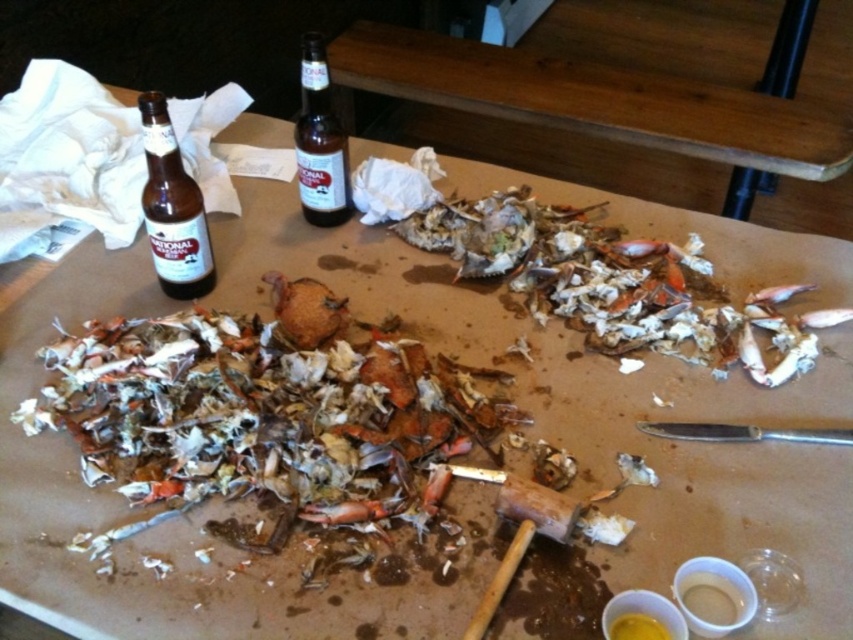
Question: Based on their relative distances, which object is farther from the brown glass bottle at left?

Choices:
 (A) brown glass bottle at center
 (B) brown wood table at upper center
 (C) brown纸质蟹壳 at center
 (D) brown crumbly crab shell at center

Answer: (B)

Question: Is brown wood table at upper center positioned before brown glass bottle at center?

Choices:
 (A) no
 (B) yes

Answer: (A)

Question: Does brown纸质蟹壳 at center appear on the left side of brown glass bottle at left?

Choices:
 (A) yes
 (B) no

Answer: (B)

Question: Which of the following is the farthest from the observer?

Choices:
 (A) (804, 179)
 (B) (189, 186)

Answer: (A)

Question: Can you confirm if brown纸质蟹壳 at center is positioned below brown glass bottle at left?

Choices:
 (A) no
 (B) yes

Answer: (B)

Question: Estimate the real-world distances between objects in this image. Which object is closer to the brown crumbly crab shell at center?

Choices:
 (A) brown wood table at upper center
 (B) brown glass bottle at center

Answer: (B)